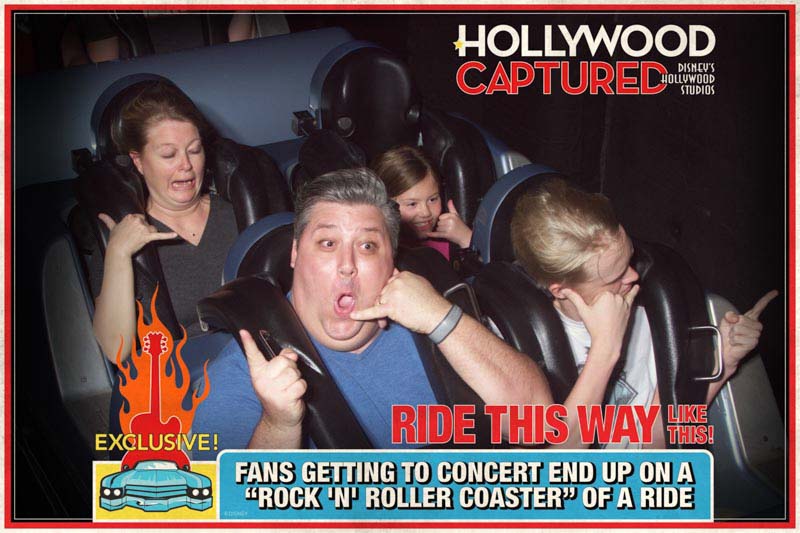
Image resolution: width=800 pixels, height=533 pixels. I want to click on seats, so click(x=374, y=107), click(x=138, y=83), click(x=274, y=244), click(x=496, y=211).